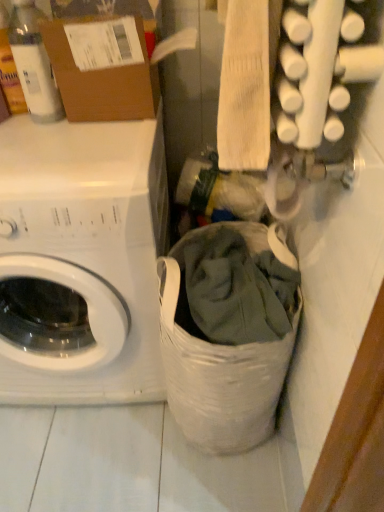
Question: Could you tell me if translucent plastic bottle at upper left is turned towards brown cardboard box at upper left?

Choices:
 (A) no
 (B) yes

Answer: (A)

Question: Can you confirm if translucent plastic bottle at upper left is smaller than brown cardboard box at upper left?

Choices:
 (A) yes
 (B) no

Answer: (A)

Question: Is translucent plastic bottle at upper left taller than brown cardboard box at upper left?

Choices:
 (A) no
 (B) yes

Answer: (B)

Question: Would you say translucent plastic bottle at upper left is a long distance from brown cardboard box at upper left?

Choices:
 (A) no
 (B) yes

Answer: (A)

Question: Is translucent plastic bottle at upper left placed right next to brown cardboard box at upper left?

Choices:
 (A) no
 (B) yes

Answer: (A)

Question: Is translucent plastic bottle at upper left looking in the opposite direction of brown cardboard box at upper left?

Choices:
 (A) yes
 (B) no

Answer: (B)

Question: Does white fabric laundry basket at lower center come in front of translucent plastic bottle at upper left?

Choices:
 (A) no
 (B) yes

Answer: (B)

Question: Can you confirm if white fabric laundry basket at lower center is smaller than translucent plastic bottle at upper left?

Choices:
 (A) no
 (B) yes

Answer: (A)

Question: From a real-world perspective, does white fabric laundry basket at lower center sit lower than translucent plastic bottle at upper left?

Choices:
 (A) yes
 (B) no

Answer: (A)

Question: Considering the relative sizes of white fabric laundry basket at lower center and translucent plastic bottle at upper left in the image provided, is white fabric laundry basket at lower center wider than translucent plastic bottle at upper left?

Choices:
 (A) yes
 (B) no

Answer: (A)

Question: From the image's perspective, is white fabric laundry basket at lower center on top of translucent plastic bottle at upper left?

Choices:
 (A) no
 (B) yes

Answer: (A)

Question: Does white fabric laundry basket at lower center touch translucent plastic bottle at upper left?

Choices:
 (A) yes
 (B) no

Answer: (B)

Question: Is translucent plastic bottle at upper left located within white matte washing machine at left?

Choices:
 (A) no
 (B) yes

Answer: (A)